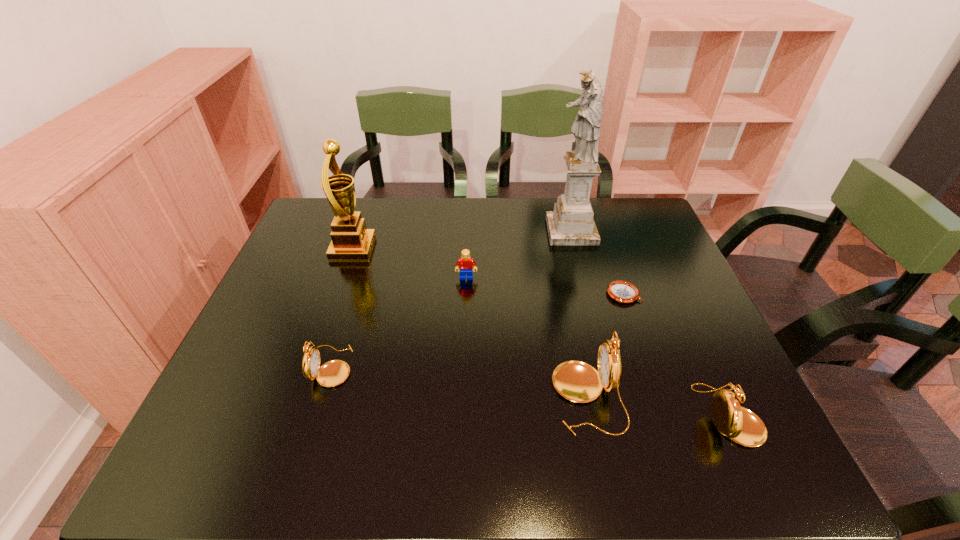
At what (x,y) coordinates should I click in order to perform the action: click on the fourth nearest object. Please return your answer as a coordinate pair (x, y). Looking at the image, I should click on (620, 291).

Find the location of a particular element. The height and width of the screenshot is (540, 960). vacant point located on the face of the leftmost pocket watch is located at coordinates (422, 366).

Identify the location of vacant point located on the face of the tallest pocket watch. (503, 397).

Where is `vacant space located on the face of the tallest pocket watch`? The image size is (960, 540). vacant space located on the face of the tallest pocket watch is located at coordinates (423, 397).

Where is `vacant region located 0.330m on the face of the tallest pocket watch`? The image size is (960, 540). vacant region located 0.330m on the face of the tallest pocket watch is located at coordinates (399, 397).

This screenshot has width=960, height=540. Identify the location of vacant region located 0.050m on the front-facing side of the sculpture. (532, 231).

The width and height of the screenshot is (960, 540). I want to click on free space located on the front-facing side of the sculpture, so click(x=426, y=231).

The image size is (960, 540). Find the location of `free space located 0.270m on the front-facing side of the sculpture`. free space located 0.270m on the front-facing side of the sculpture is located at coordinates (462, 231).

Locate an element on the screen. The image size is (960, 540). vacant point located 0.110m on the front-facing side of the award is located at coordinates (410, 248).

You are a GUI agent. You are given a task and a screenshot of the screen. Output one action in this format:
    pyautogui.click(x=<x>, y=<y>)
    Task: Click on the free space located on the front-facing side of the fifth object from right to left
    
    Given the screenshot: What is the action you would take?
    pyautogui.click(x=465, y=336)